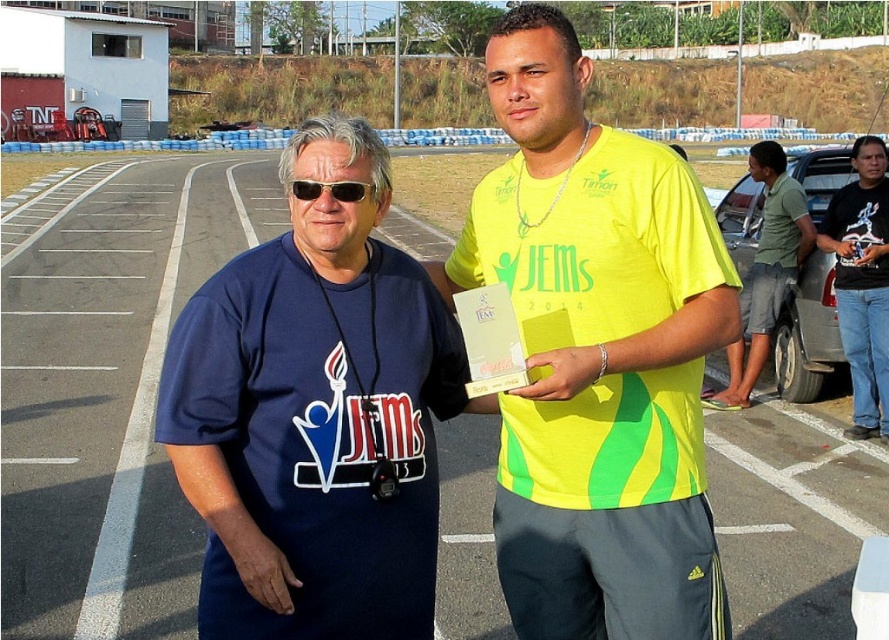
Based on the photo, you are a photographer trying to capture a clear photo of both the yellow matte shirt at center and the gold metallic sunglasses at center. Since you want to ensure both are visible, which object should you focus on first to account for their sizes?

The yellow matte shirt at center is bigger than the gold metallic sunglasses at center, so you should focus on the yellow matte shirt at center first since it takes up more space in the frame and will require more precise focus to ensure clarity.

You are a photographer positioned in front of the scene. You want to take a photo that includes both the yellow matte shirt at center and the gray metallic car at right. Which object should you focus on first to ensure both are in sharp focus?

You should focus on the yellow matte shirt at center first because it is closer to the viewer than the gray metallic car at right, so focusing on the closer object will help keep both in focus when using a narrow aperture or adjusting the depth of field.

You are standing in the parking lot and want to walk to the gray metallic car at right. If your walking speed is 1.5 meters per second, how many seconds will it take you to reach the car?

The distance between the gray metallic car at right and the viewer is 6.09 meters. At a walking speed of 1.5 meters per second, it would take approximately 4.06 seconds to reach the car.